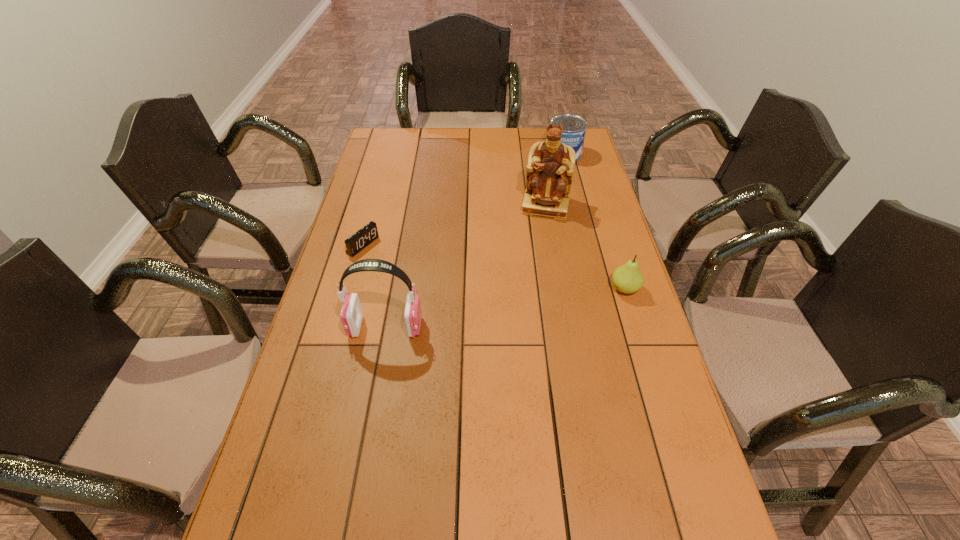
The width and height of the screenshot is (960, 540). In the image, there is a desktop. What are the coordinates of `free space at the right edge` in the screenshot? It's located at (583, 239).

In order to click on vacant space that's between the can and the alarm clock in this screenshot , I will do `click(464, 200)`.

Locate an element on the screen. The width and height of the screenshot is (960, 540). free space between the second nearest object and the figurine is located at coordinates (585, 247).

Image resolution: width=960 pixels, height=540 pixels. In order to click on vacant region between the tallest object and the alarm clock in this screenshot , I will do `click(454, 226)`.

This screenshot has height=540, width=960. What are the coordinates of `free space between the earphone and the shortest object` in the screenshot? It's located at pyautogui.click(x=374, y=286).

The width and height of the screenshot is (960, 540). Find the location of `free space between the fourth farthest object and the fourth nearest object`. free space between the fourth farthest object and the fourth nearest object is located at coordinates (585, 247).

Find the location of a particular element. free space between the farthest object and the pear is located at coordinates (594, 221).

At what (x,y) coordinates should I click in order to perform the action: click on empty location between the nearest object and the farthest object. Please return your answer as a coordinate pair (x, y). The width and height of the screenshot is (960, 540). Looking at the image, I should click on 475,240.

This screenshot has height=540, width=960. I want to click on empty space between the can and the pear, so click(x=594, y=221).

Where is `free point between the farthest object and the nearest object`? This screenshot has height=540, width=960. free point between the farthest object and the nearest object is located at coordinates (475, 240).